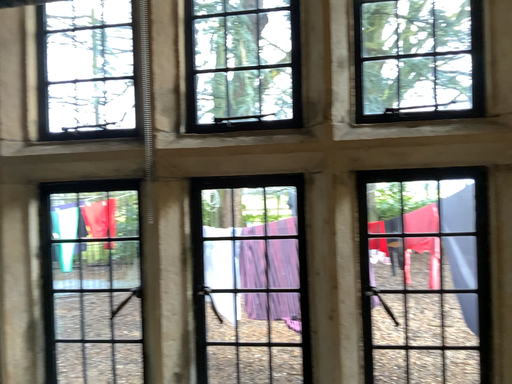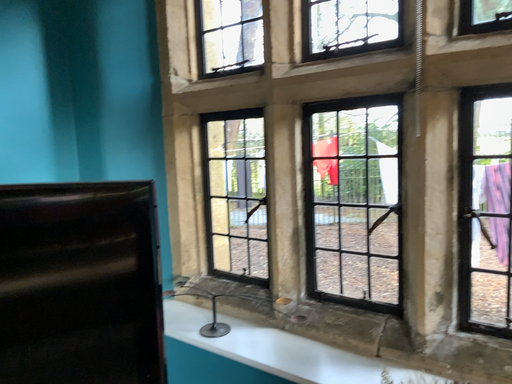
Question: Which way did the camera rotate in the video?

Choices:
 (A) rotated right
 (B) rotated left

Answer: (B)